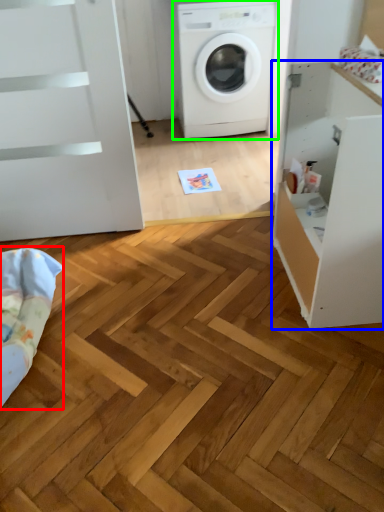
Question: Considering the real-world distances, which object is farthest from bedding (highlighted by a red box)? file cabinet (highlighted by a blue box) or washing machine (highlighted by a green box)?

Choices:
 (A) file cabinet
 (B) washing machine

Answer: (B)